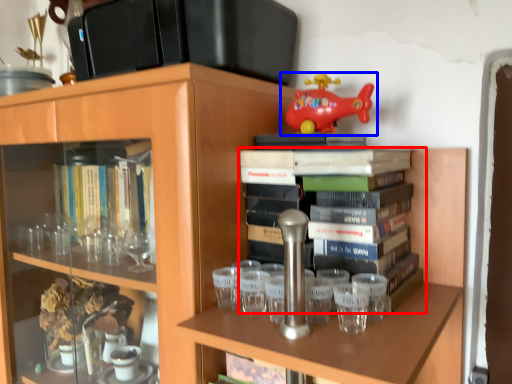
Question: Which of the following is the farthest to the observer, book (highlighted by a red box) or toy (highlighted by a blue box)?

Choices:
 (A) book
 (B) toy

Answer: (B)